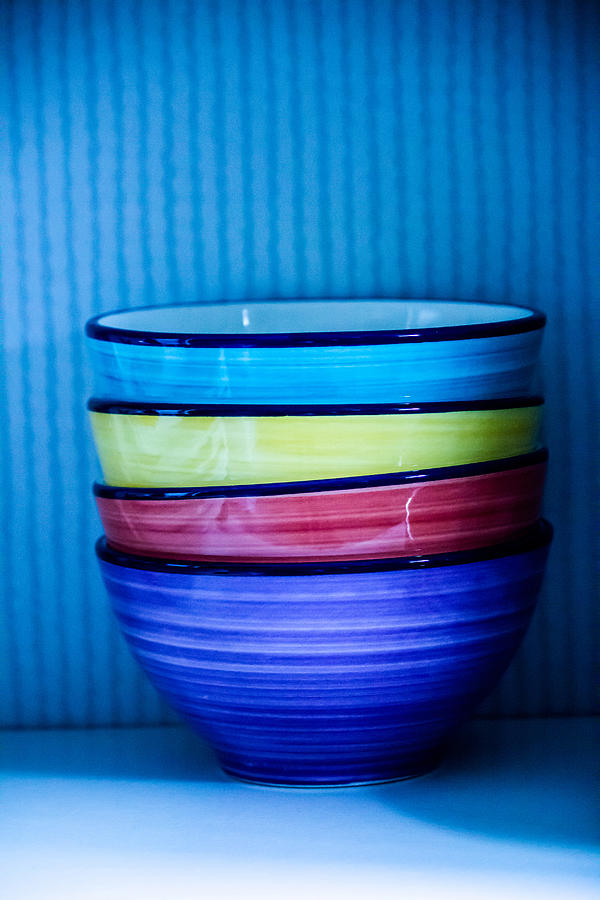
I want to click on light blue bowl, so click(306, 381).